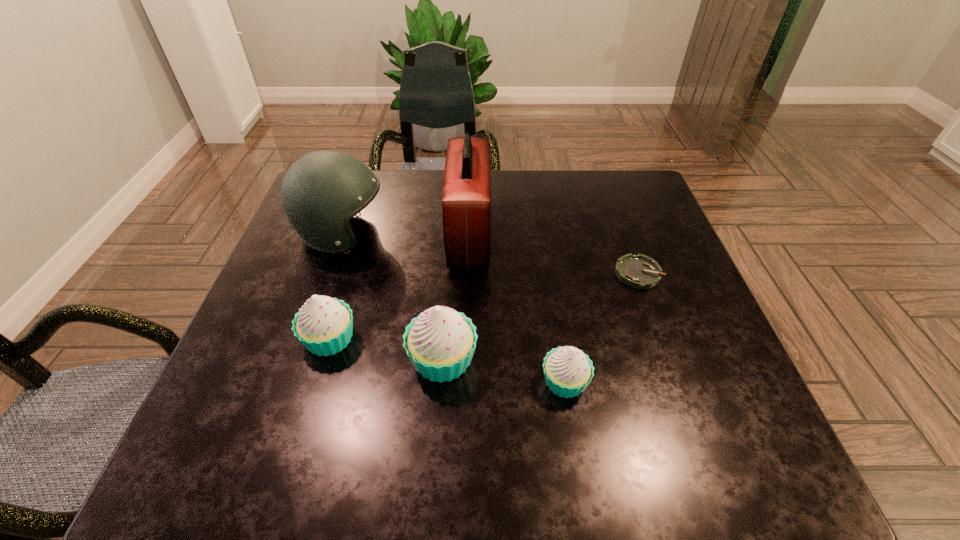
You are a GUI agent. You are given a task and a screenshot of the screen. Output one action in this format:
    pyautogui.click(x=<x>, y=<y>)
    Task: Click on the free space between the second cupcake from right to left and the first aid kit
    
    Given the screenshot: What is the action you would take?
    pyautogui.click(x=456, y=298)

Locate an element on the screen. Image resolution: width=960 pixels, height=540 pixels. unoccupied area between the second shortest cupcake and the football helmet is located at coordinates (336, 287).

Identify the location of free space between the fourth tallest object and the third tallest object. (386, 349).

Find the location of a particular element. vacant region between the shortest object and the shortest cupcake is located at coordinates (602, 327).

Find the location of a particular element. This screenshot has width=960, height=540. free space between the first aid kit and the rightmost cupcake is located at coordinates point(516,308).

Identify the location of free space between the third shortest object and the football helmet. The width and height of the screenshot is (960, 540). (336, 287).

Where is `vacant area that lies between the football helmet and the shortest object`? The width and height of the screenshot is (960, 540). vacant area that lies between the football helmet and the shortest object is located at coordinates (491, 254).

The height and width of the screenshot is (540, 960). Find the location of `free space that is in between the shortest object and the shortest cupcake`. free space that is in between the shortest object and the shortest cupcake is located at coordinates (602, 327).

Locate which object is the third closest to the first aid kit. Please provide its 2D coordinates. Your answer should be formatted as a tuple, i.e. [(x, y)], where the tuple contains the x and y coordinates of a point satisfying the conditions above.

[(324, 325)]

Identify which object is the fifth closest to the first aid kit. Please provide its 2D coordinates. Your answer should be formatted as a tuple, i.e. [(x, y)], where the tuple contains the x and y coordinates of a point satisfying the conditions above.

[(639, 271)]